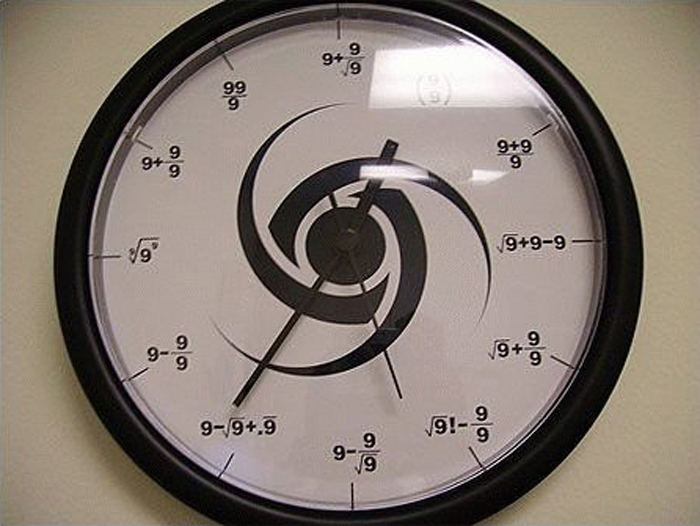
The height and width of the screenshot is (526, 700). I want to click on 3 black swirly designs in center of clock, so click(x=267, y=268), click(x=302, y=188), click(x=409, y=234).